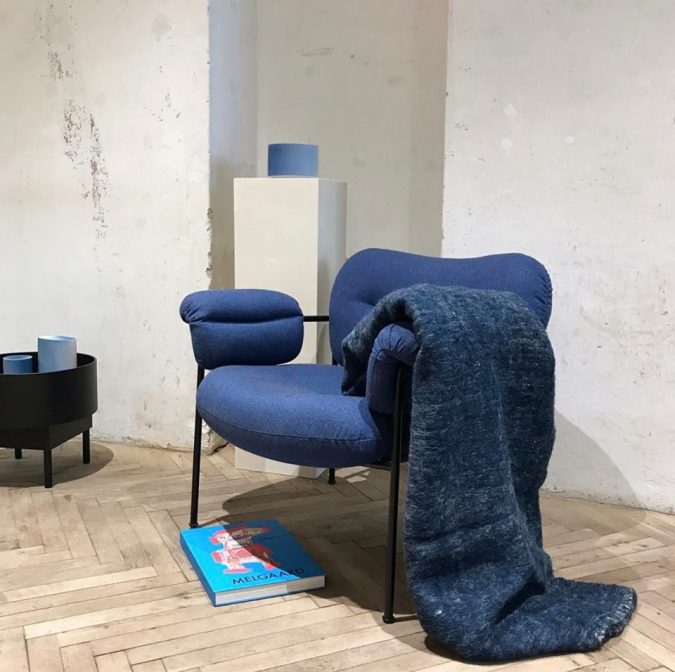
I want to click on alcove, so click(x=373, y=69).